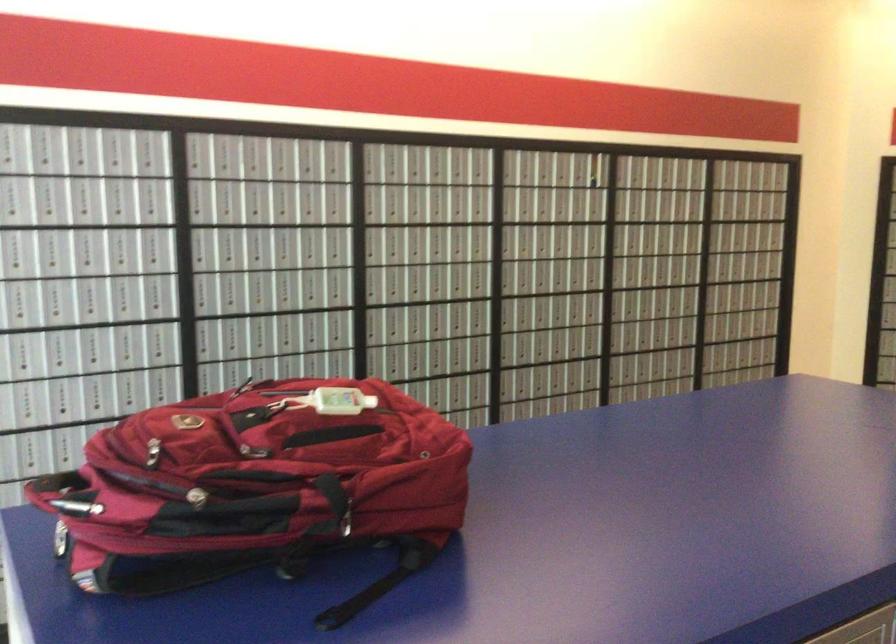
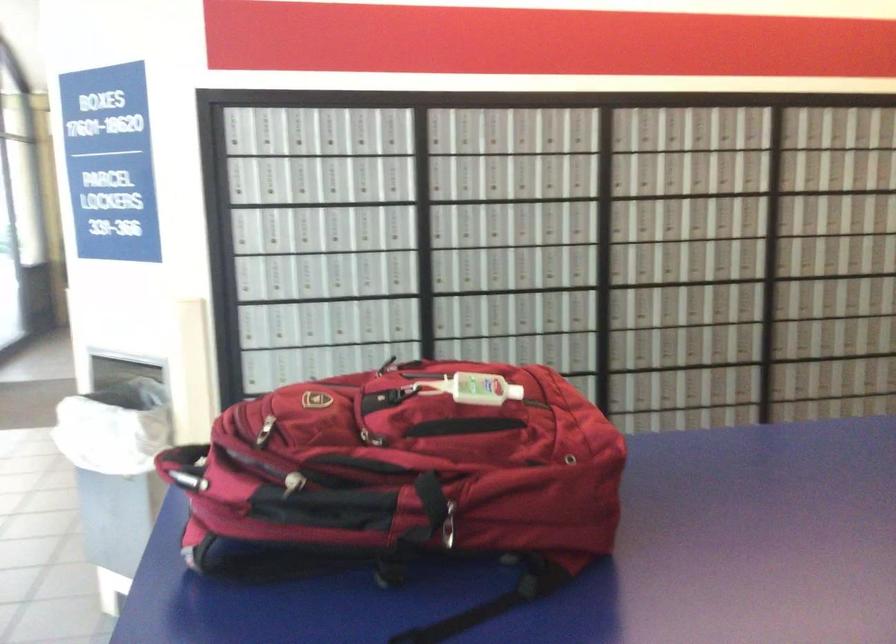
Find the pixel in the second image that matches the point at 162,450 in the first image.

(264, 430)